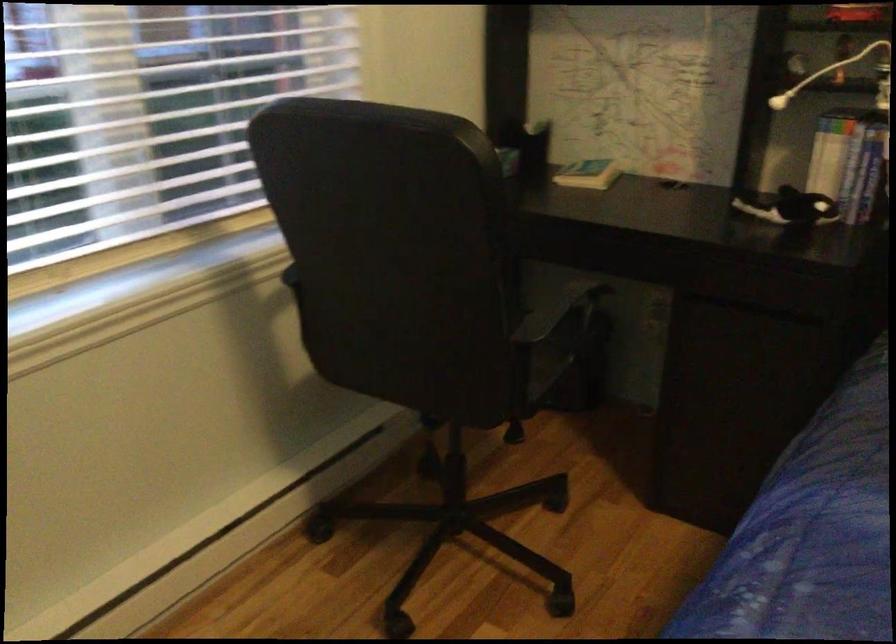
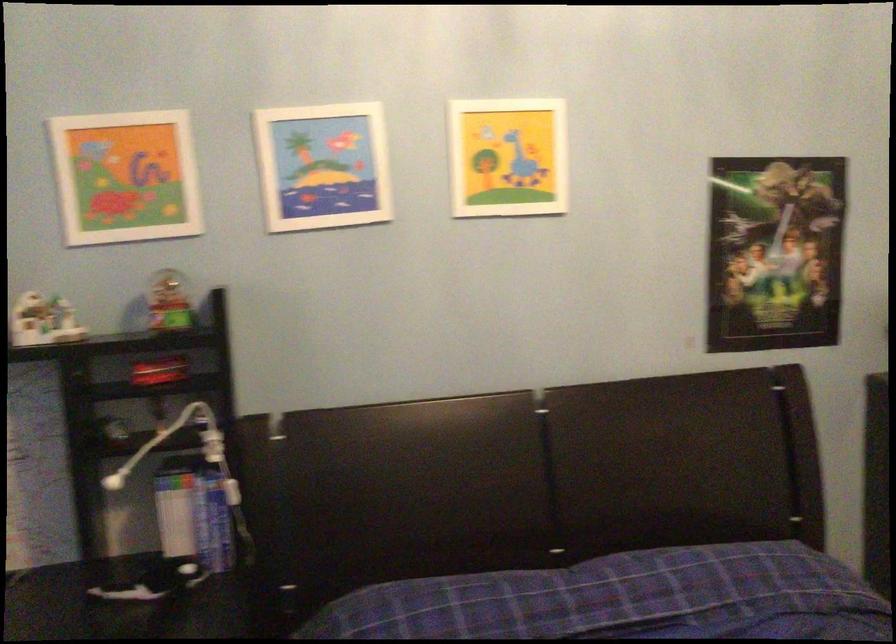
Question: The camera is either moving clockwise (left) or counter-clockwise (right) around the object. The first image is from the beginning of the video and the second image is from the end. Is the camera moving left or right when shooting the video?

Choices:
 (A) Left
 (B) Right

Answer: (A)